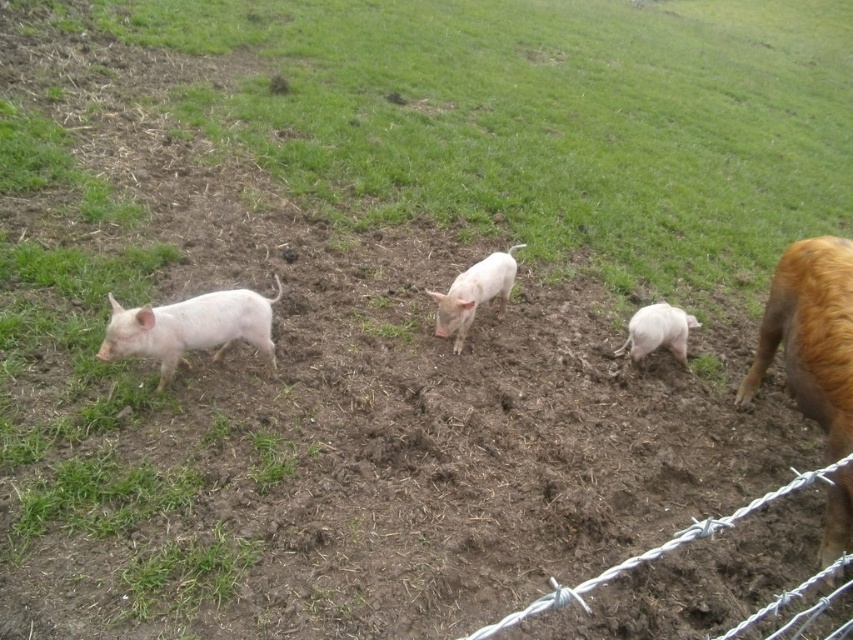
You are a farmer checking the fence. You notice the barbed wire at lower right and the pink smooth piglet at center. Which object is bigger in size?

The barbed wire at lower right is larger in size than the pink smooth piglet at center.

Consider the image. You are a farmer checking the fence. You notice the barbed wire at lower right and the pink smooth piglet at center. Which object is closer to the ground?

The barbed wire at lower right is positioned under the pink smooth piglet at center, so it is closer to the ground.

You are standing in the field where the pigs are. You need to reach a fence located at point (653, 552). What is at that point?

The barbed wire at lower right is located at point (653, 552).